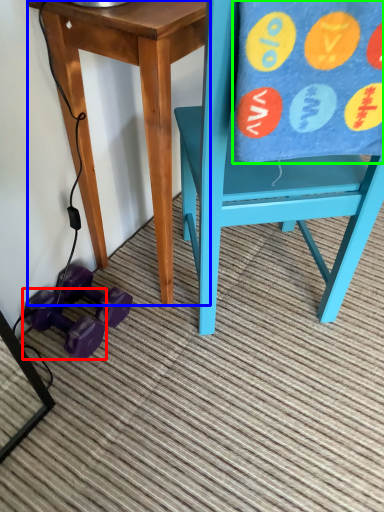
Question: Estimate the real-world distances between objects in this image. Which object is farther from dumbbell (highlighted by a red box), table (highlighted by a blue box) or beach towel (highlighted by a green box)?

Choices:
 (A) table
 (B) beach towel

Answer: (B)